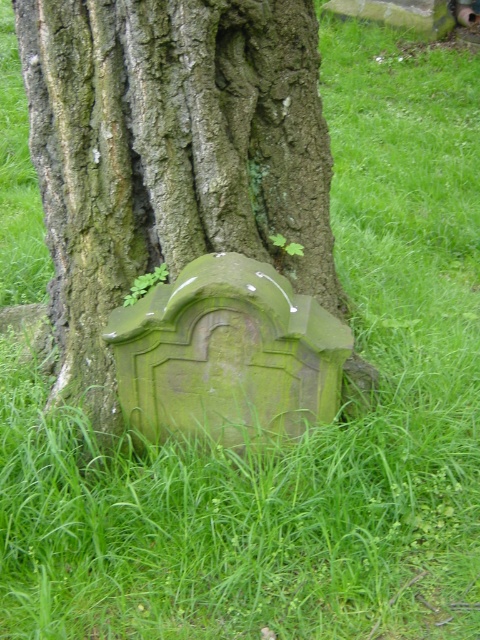
Question: Which point appears closest to the camera in this image?

Choices:
 (A) (219, 166)
 (B) (157, 372)

Answer: (A)

Question: Is green mossy stone at lower center above green stone gravestone at lower center?

Choices:
 (A) no
 (B) yes

Answer: (B)

Question: Is green mossy stone at lower center positioned before green stone gravestone at lower center?

Choices:
 (A) yes
 (B) no

Answer: (B)

Question: Which point appears closest to the camera in this image?

Choices:
 (A) (292, 305)
 (B) (309, 188)

Answer: (A)

Question: Which of the following is the closest to the observer?

Choices:
 (A) (149, 12)
 (B) (199, 316)

Answer: (A)

Question: Can you confirm if green mossy stone at lower center is positioned to the left of green stone gravestone at lower center?

Choices:
 (A) yes
 (B) no

Answer: (A)